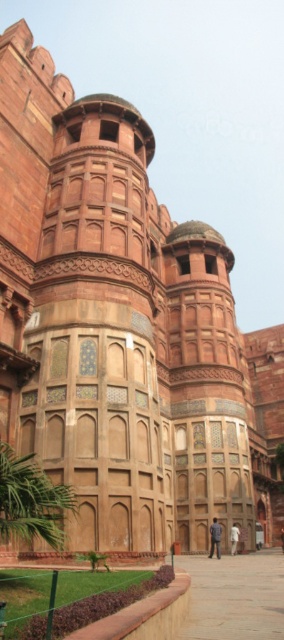
Question: Which of the following is the farthest from the observer?

Choices:
 (A) (282, 548)
 (B) (237, 541)

Answer: (A)

Question: Is dark blue fabric at center closer to the viewer compared to dark brown leather jacket at center?

Choices:
 (A) yes
 (B) no

Answer: (A)

Question: Is dark blue fabric at center positioned at the back of dark brown leather jacket at center?

Choices:
 (A) yes
 (B) no

Answer: (B)

Question: Which of the following is the closest to the observer?

Choices:
 (A) 230,536
 (B) 280,541
 (C) 220,528

Answer: (C)

Question: Is dark blue fabric at center wider than dark brown leather jacket at center?

Choices:
 (A) no
 (B) yes

Answer: (B)

Question: Which of these objects is positioned farthest from the dark brown leather jacket at center?

Choices:
 (A) blue denim jacket at center
 (B) dark blue fabric at center

Answer: (A)